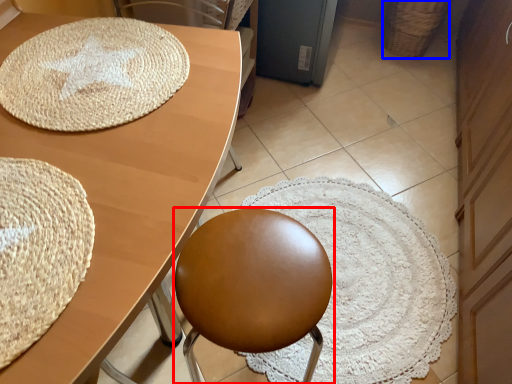
Question: Which of the following is the farthest to the observer, chair (highlighted by a red box) or basket (highlighted by a blue box)?

Choices:
 (A) chair
 (B) basket

Answer: (B)